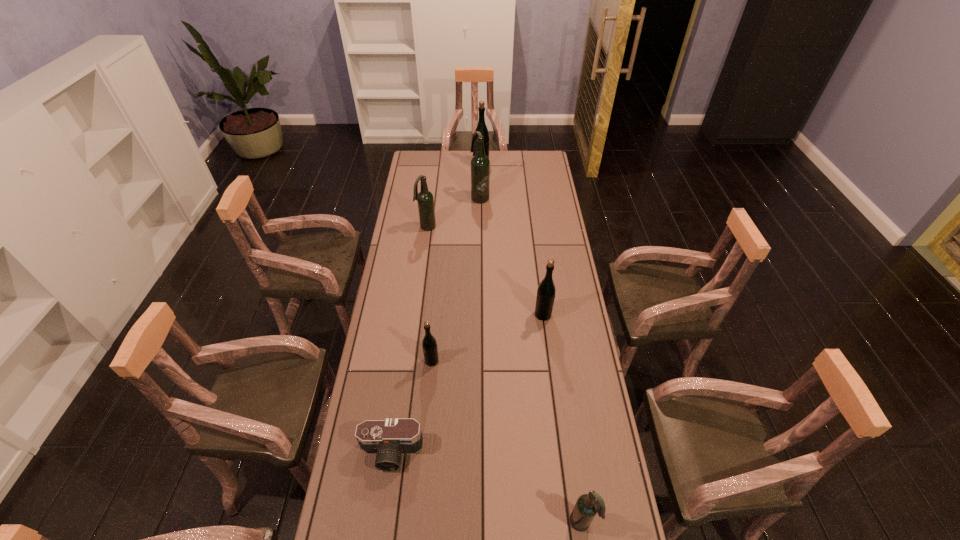
You are a GUI agent. You are given a task and a screenshot of the screen. Output one action in this format:
    pyautogui.click(x=<x>, y=<y>)
    Task: Click on the farthest object
    The image size is (960, 540).
    Given the screenshot: What is the action you would take?
    pyautogui.click(x=481, y=127)

Where is `the second green beer bottle from left to right`? the second green beer bottle from left to right is located at coordinates (481, 127).

Identify the location of the fifth nearest beer bottle. This screenshot has width=960, height=540. (480, 165).

In order to click on the sixth nearest object in this screenshot , I will do `click(480, 165)`.

You are a GUI agent. You are given a task and a screenshot of the screen. Output one action in this format:
    pyautogui.click(x=<x>, y=<y>)
    Task: Click on the second smallest dark beer bottle
    
    Given the screenshot: What is the action you would take?
    pyautogui.click(x=425, y=200)

Where is `the third farthest beer bottle`? This screenshot has height=540, width=960. the third farthest beer bottle is located at coordinates [x=425, y=200].

Where is `the fourth farthest beer bottle`? The image size is (960, 540). the fourth farthest beer bottle is located at coordinates (546, 290).

Where is `the second biggest green beer bottle`? the second biggest green beer bottle is located at coordinates (546, 290).

You are a GUI agent. You are given a task and a screenshot of the screen. Output one action in this format:
    pyautogui.click(x=<x>, y=<y>)
    Task: Click on the second nearest beer bottle
    This screenshot has width=960, height=540.
    Given the screenshot: What is the action you would take?
    pyautogui.click(x=429, y=344)

I want to click on the fifth beer bottle from right to left, so click(429, 344).